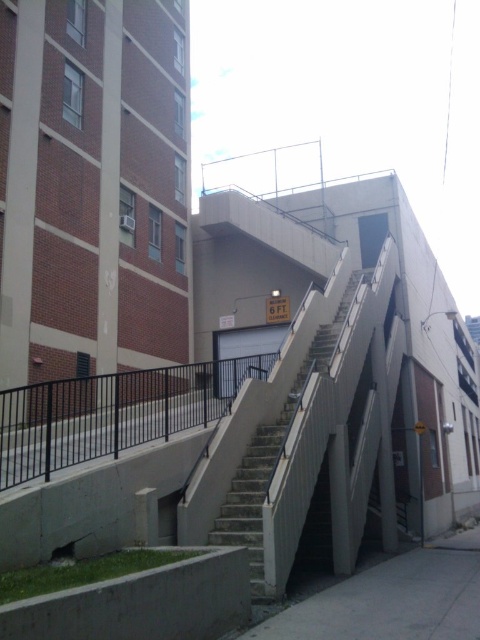
Can you confirm if black metal railing at lower left is shorter than concrete stairs at center?

Yes, black metal railing at lower left is shorter than concrete stairs at center.

You are a GUI agent. You are given a task and a screenshot of the screen. Output one action in this format:
    pyautogui.click(x=<x>, y=<y>)
    Task: Click on the black metal railing at lower left
    This screenshot has height=640, width=480.
    Given the screenshot: What is the action you would take?
    pyautogui.click(x=112, y=412)

In the scene shown: Does gray concrete pavement at lower center have a greater width compared to concrete stairs at center?

Correct, the width of gray concrete pavement at lower center exceeds that of concrete stairs at center.

Can you confirm if gray concrete pavement at lower center is positioned to the left of concrete stairs at center?

Incorrect, gray concrete pavement at lower center is not on the left side of concrete stairs at center.

Between point (280, 611) and point (247, 536), which one is positioned behind?

The point (247, 536) is more distant.

This screenshot has height=640, width=480. I want to click on gray concrete pavement at lower center, so click(389, 600).

Is black metal railing at lower left wider than gray concrete pavement at lower center?

Correct, the width of black metal railing at lower left exceeds that of gray concrete pavement at lower center.

Does black metal railing at lower left appear under gray concrete pavement at lower center?

Incorrect, black metal railing at lower left is not positioned below gray concrete pavement at lower center.

Describe the element at coordinates (112, 412) in the screenshot. The width and height of the screenshot is (480, 640). I see `black metal railing at lower left` at that location.

You are a GUI agent. You are given a task and a screenshot of the screen. Output one action in this format:
    pyautogui.click(x=<x>, y=<y>)
    Task: Click on the black metal railing at lower left
    
    Given the screenshot: What is the action you would take?
    pyautogui.click(x=112, y=412)